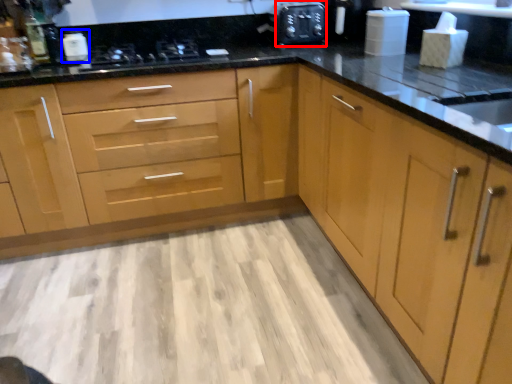
Question: Which object is closer to the camera taking this photo, appliance (highlighted by a red box) or appliance (highlighted by a blue box)?

Choices:
 (A) appliance
 (B) appliance

Answer: (B)